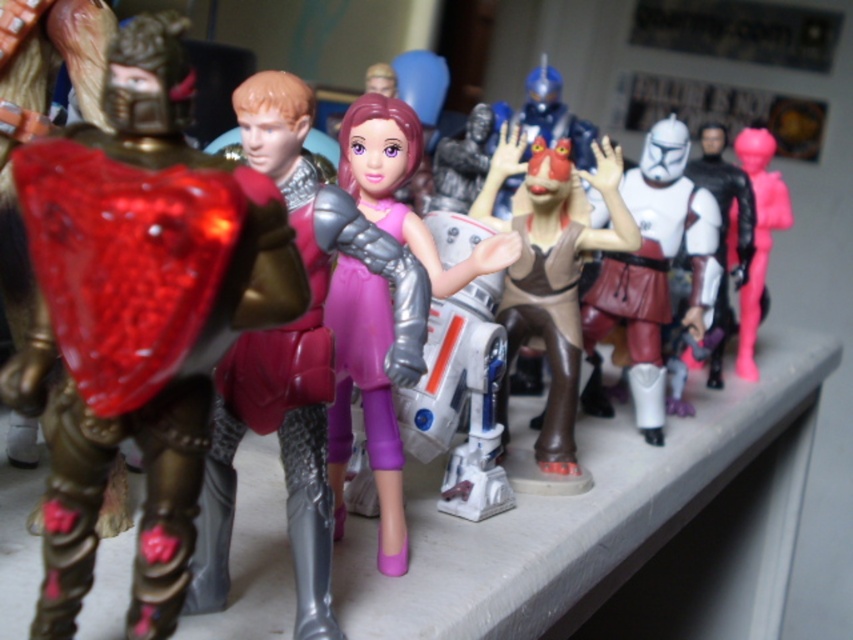
Question: Can you confirm if purple matte/glossy doll at center is positioned below white matte helmet at center?

Choices:
 (A) no
 (B) yes

Answer: (B)

Question: Which point is farther to the camera?

Choices:
 (A) pink matte figure at right
 (B) purple matte/glossy doll at center

Answer: (A)

Question: Which object appears farthest from the camera in this image?

Choices:
 (A) pink matte figure at right
 (B) white matte helmet at center

Answer: (A)

Question: Is purple matte/glossy doll at center positioned in front of pink matte figure at right?

Choices:
 (A) no
 (B) yes

Answer: (B)

Question: Does purple matte/glossy doll at center appear under white matte helmet at center?

Choices:
 (A) no
 (B) yes

Answer: (B)

Question: Which object appears closest to the camera in this image?

Choices:
 (A) purple matte/glossy doll at center
 (B) white matte helmet at center
 (C) pink matte figure at right

Answer: (A)